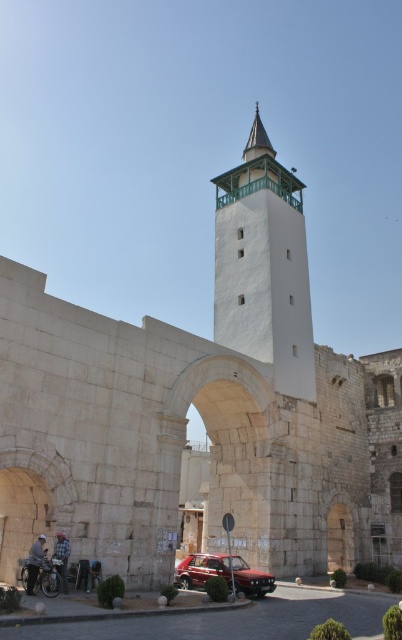
Question: Based on their relative distances, which object is nearer to the metallic red car at center?

Choices:
 (A) blue plaid shirt at lower left
 (B) denim jacket at lower left
 (C) shiny chrome motorcycle at lower left

Answer: (B)

Question: Which object is closer to the camera taking this photo?

Choices:
 (A) metallic red car at center
 (B) white stone minaret at center

Answer: (A)

Question: Can you confirm if light blue denim jacket at lower left is positioned above blue plaid shirt at lower left?

Choices:
 (A) no
 (B) yes

Answer: (B)

Question: Does metallic red car at center appear on the left side of shiny chrome motorcycle at lower left?

Choices:
 (A) yes
 (B) no

Answer: (B)

Question: Which point is farther from the camera taking this photo?

Choices:
 (A) (274, 192)
 (B) (225, 561)
 (C) (43, 593)
 (D) (32, 576)

Answer: (A)

Question: Can you confirm if shiny chrome motorcycle at lower left is positioned to the left of denim jacket at lower left?

Choices:
 (A) no
 (B) yes

Answer: (B)